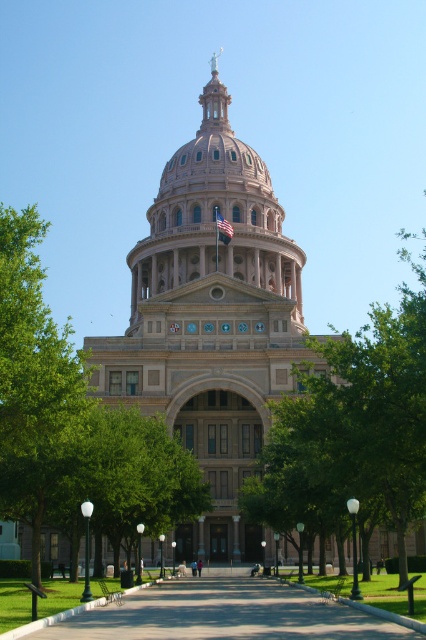
Which of these two, green leafy tree at center or paved concrete path at center, stands taller?

green leafy tree at center is taller.

Which is in front, point (345, 387) or point (314, 592)?

Point (314, 592) is in front.

You are a GUI agent. You are given a task and a screenshot of the screen. Output one action in this format:
    pyautogui.click(x=<x>, y=<y>)
    Task: Click on the green leafy tree at center
    This screenshot has width=426, height=640.
    Given the screenshot: What is the action you would take?
    pyautogui.click(x=353, y=432)

This screenshot has height=640, width=426. Identify the location of green leafy tree at center. (353, 432).

Who is more distant from viewer, (172, 198) or (207, 632)?

Point (172, 198)

Between beige stone dome at center and paved concrete path at center, which one appears on the right side from the viewer's perspective?

From the viewer's perspective, paved concrete path at center appears more on the right side.

The height and width of the screenshot is (640, 426). Find the location of `beige stone dome at center`. beige stone dome at center is located at coordinates (215, 216).

In the scene shown: Can you confirm if green leafy tree at center is positioned below beige stone dome at center?

Indeed, green leafy tree at center is positioned under beige stone dome at center.

Which is more to the right, green leafy tree at center or beige stone dome at center?

Positioned to the right is green leafy tree at center.

Is point (402, 362) positioned before point (204, 275)?

That is True.

This screenshot has height=640, width=426. In order to click on green leafy tree at center in this screenshot , I will do `click(353, 432)`.